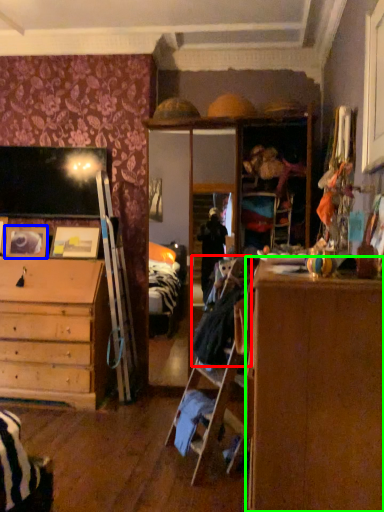
Question: Which is nearer to the laundry (highlighted by a red box)? picture frame (highlighted by a blue box) or cabinetry (highlighted by a green box).

Choices:
 (A) picture frame
 (B) cabinetry

Answer: (B)